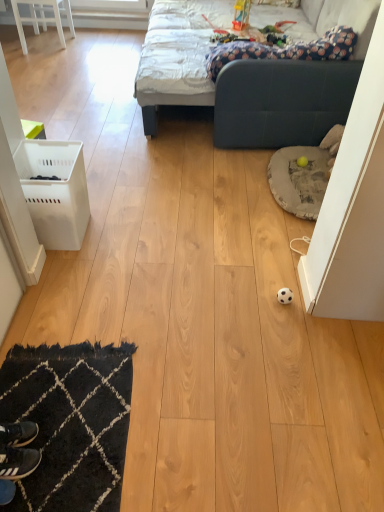
Question: Does black leather shoe at lower left appear on the left side of black textured rug at lower left?

Choices:
 (A) yes
 (B) no

Answer: (A)

Question: Are black leather shoe at lower left and black textured rug at lower left making contact?

Choices:
 (A) no
 (B) yes

Answer: (A)

Question: Is black leather shoe at lower left bigger than black textured rug at lower left?

Choices:
 (A) no
 (B) yes

Answer: (A)

Question: From a real-world perspective, is black leather shoe at lower left under black textured rug at lower left?

Choices:
 (A) yes
 (B) no

Answer: (B)

Question: Is the depth of black leather shoe at lower left greater than that of black textured rug at lower left?

Choices:
 (A) no
 (B) yes

Answer: (B)

Question: Does black leather shoe at lower left have a lesser height compared to black textured rug at lower left?

Choices:
 (A) no
 (B) yes

Answer: (A)

Question: Can you confirm if black leather shoe at lower left is positioned to the left of dark blue fabric couch at upper center?

Choices:
 (A) yes
 (B) no

Answer: (A)

Question: From a real-world perspective, is black leather shoe at lower left physically below dark blue fabric couch at upper center?

Choices:
 (A) no
 (B) yes

Answer: (B)

Question: Considering the relative sizes of black leather shoe at lower left and dark blue fabric couch at upper center in the image provided, is black leather shoe at lower left smaller than dark blue fabric couch at upper center?

Choices:
 (A) no
 (B) yes

Answer: (B)

Question: From the image's perspective, is black leather shoe at lower left under dark blue fabric couch at upper center?

Choices:
 (A) yes
 (B) no

Answer: (A)

Question: Is black leather shoe at lower left further to the viewer compared to dark blue fabric couch at upper center?

Choices:
 (A) no
 (B) yes

Answer: (A)

Question: Is black leather shoe at lower left facing away from dark blue fabric couch at upper center?

Choices:
 (A) no
 (B) yes

Answer: (A)

Question: Can you confirm if black leather shoe at lower left is wider than white plastic laundry basket at left?

Choices:
 (A) yes
 (B) no

Answer: (B)